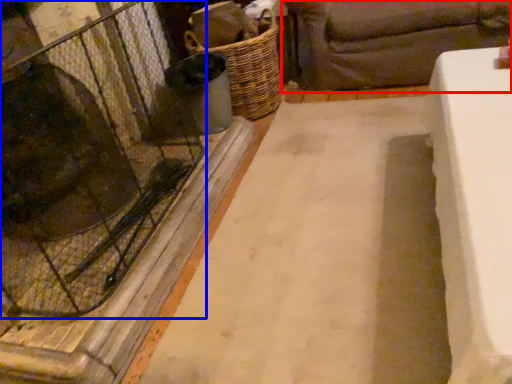
Question: Among these objects, which one is nearest to the camera, studio couch (highlighted by a red box) or glass door (highlighted by a blue box)?

Choices:
 (A) studio couch
 (B) glass door

Answer: (B)